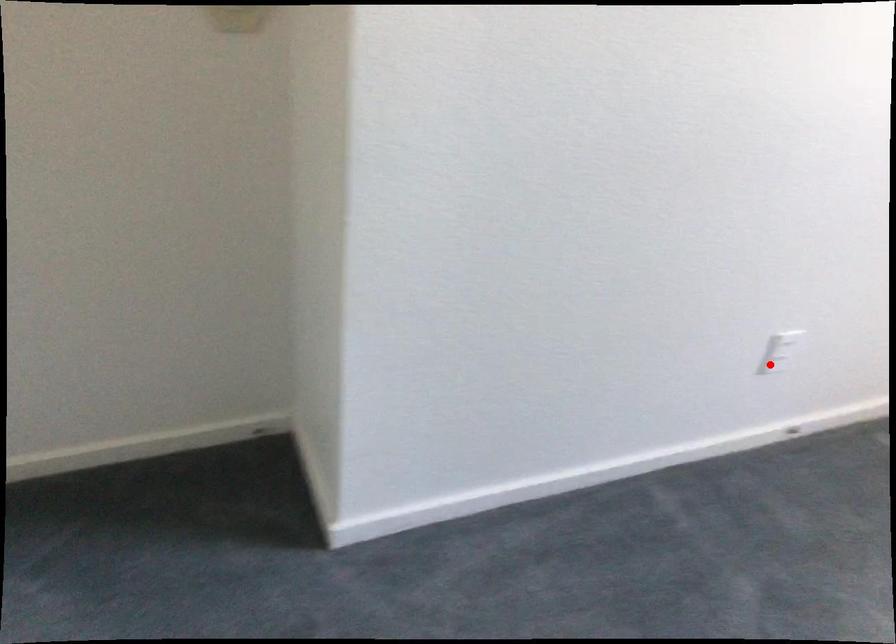
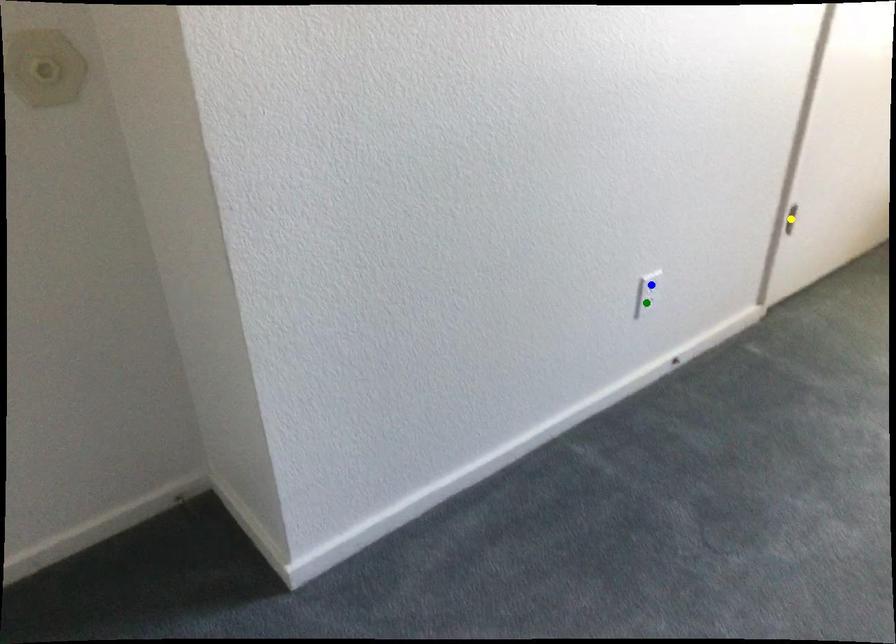
Question: I am providing you with two images of the same scene from different viewpoints. A red point is marked on the first image. You are given multiple points on the second image. Can you choose the point in image 2 that corresponds to the point in image 1?

Choices:
 (A) yellow point
 (B) green point
 (C) blue point

Answer: (B)